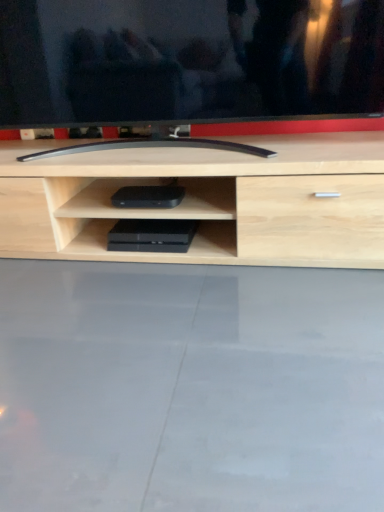
Question: From the image's perspective, would you say black plastic device at center, which is the 1th equipment from top to bottom, is shown under black glossy tv at center?

Choices:
 (A) no
 (B) yes

Answer: (B)

Question: From a real-world perspective, is black plastic device at center, which is the 1th equipment from top to bottom, on top of black glossy tv at center?

Choices:
 (A) yes
 (B) no

Answer: (B)

Question: Could you tell me if black plastic device at center, which is the 1th equipment from top to bottom, is facing black glossy tv at center?

Choices:
 (A) no
 (B) yes

Answer: (A)

Question: Does black plastic device at center, the 2th equipment when ordered from bottom to top, appear on the left side of black glossy tv at center?

Choices:
 (A) no
 (B) yes

Answer: (B)

Question: From a real-world perspective, is black plastic device at center, which is the 1th equipment from top to bottom, beneath black glossy tv at center?

Choices:
 (A) no
 (B) yes

Answer: (B)

Question: Does black plastic device at center, which is the 1th equipment from top to bottom, have a greater height compared to black glossy tv at center?

Choices:
 (A) no
 (B) yes

Answer: (A)

Question: Can you confirm if black plastic device at center, the 2th equipment when ordered from bottom to top, is thinner than black plastic game console at center, positioned as the second equipment in top-to-bottom order?

Choices:
 (A) no
 (B) yes

Answer: (A)

Question: Is black plastic device at center, which is the 1th equipment from top to bottom, facing away from black plastic game console at center, the first equipment when ordered from bottom to top?

Choices:
 (A) yes
 (B) no

Answer: (B)

Question: Can we say black plastic device at center, the 2th equipment when ordered from bottom to top, lies outside black plastic game console at center, the first equipment when ordered from bottom to top?

Choices:
 (A) no
 (B) yes

Answer: (B)

Question: Is black plastic device at center, the 2th equipment when ordered from bottom to top, closer to the viewer compared to black plastic game console at center, positioned as the second equipment in top-to-bottom order?

Choices:
 (A) no
 (B) yes

Answer: (B)

Question: Can you confirm if black plastic device at center, which is the 1th equipment from top to bottom, is positioned to the right of black plastic game console at center, the first equipment when ordered from bottom to top?

Choices:
 (A) yes
 (B) no

Answer: (A)

Question: Is black plastic device at center, the 2th equipment when ordered from bottom to top, far from black plastic game console at center, positioned as the second equipment in top-to-bottom order?

Choices:
 (A) no
 (B) yes

Answer: (A)

Question: Is black glossy tv at center located outside black plastic game console at center, the first equipment when ordered from bottom to top?

Choices:
 (A) no
 (B) yes

Answer: (B)